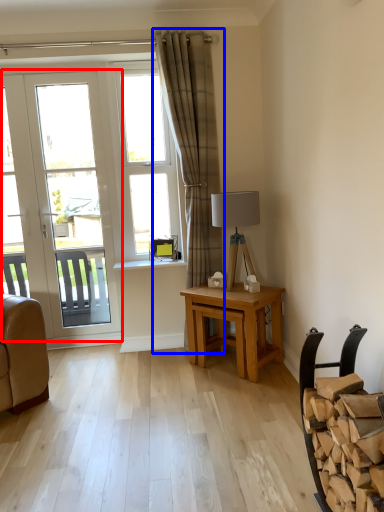
Question: Which object is further to the camera taking this photo, door (highlighted by a red box) or curtain (highlighted by a blue box)?

Choices:
 (A) door
 (B) curtain

Answer: (A)